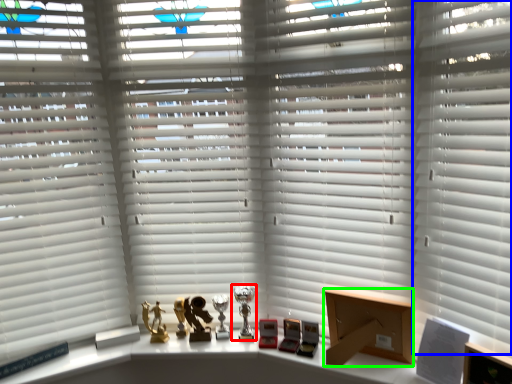
Question: Estimate the real-world distances between objects in this image. Which object is closer to table lamp (highlighted by a red box), shutter (highlighted by a blue box) or cardboard box (highlighted by a green box)?

Choices:
 (A) shutter
 (B) cardboard box

Answer: (B)